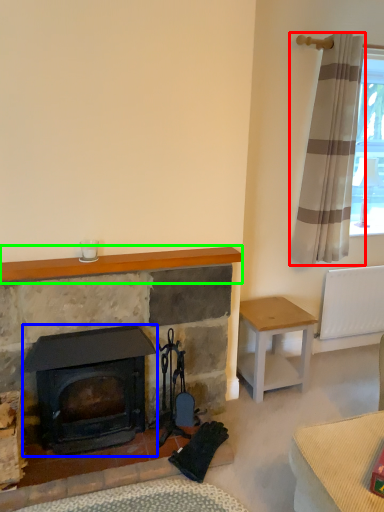
Question: Which object is the closest to the curtain (highlighted by a red box)? Choose among these: wood burning stove (highlighted by a blue box) or mantle (highlighted by a green box).

Choices:
 (A) wood burning stove
 (B) mantle

Answer: (B)